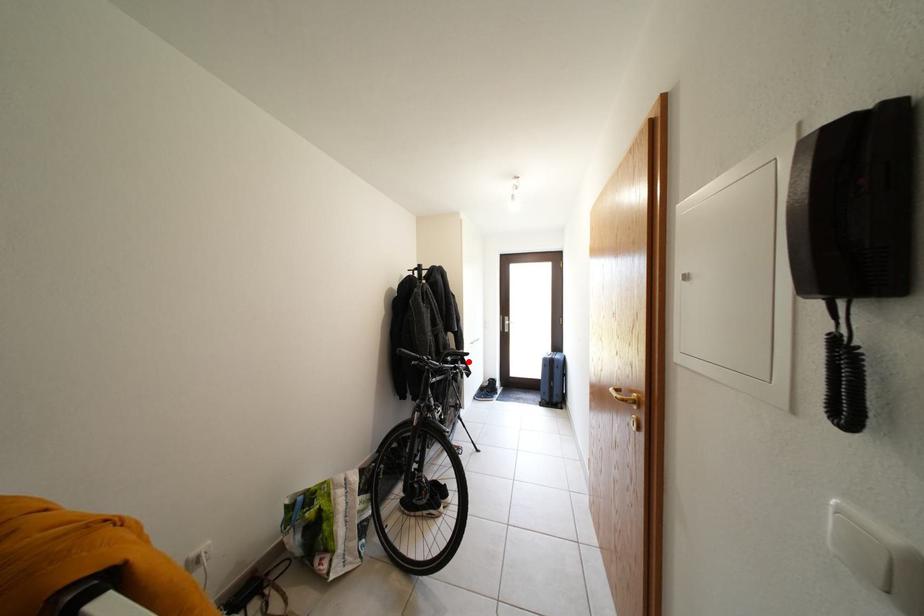
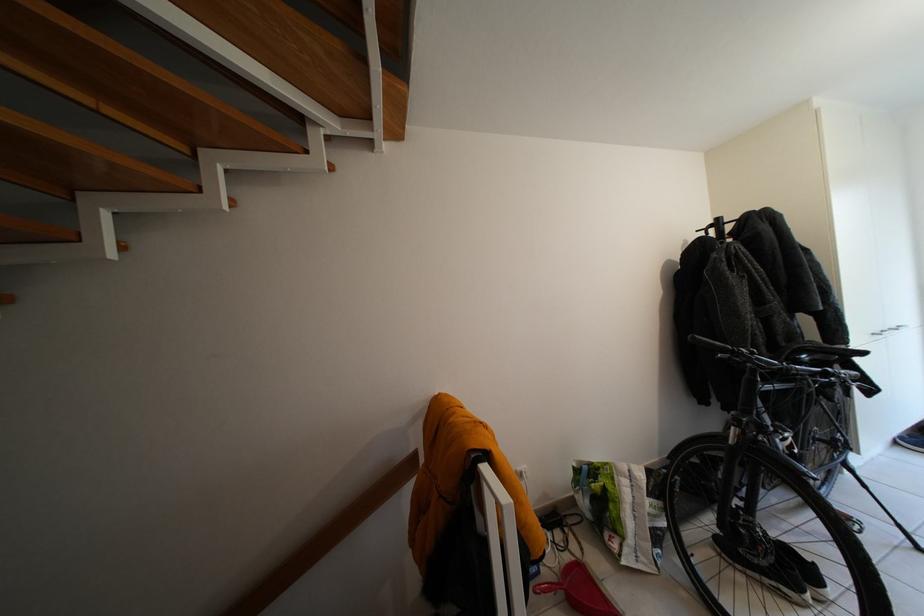
Question: I am providing you with two images of the same scene from different viewpoints. Given a red point in image1, look at the same physical point in image2. Is it:

Choices:
 (A) Closer to the viewpoint
 (B) Farther from the viewpoint

Answer: (A)